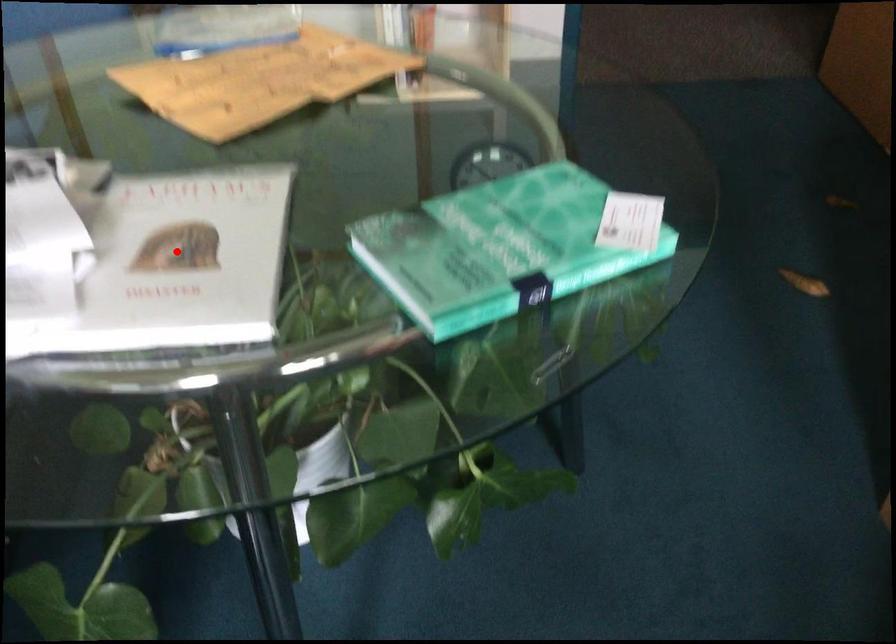
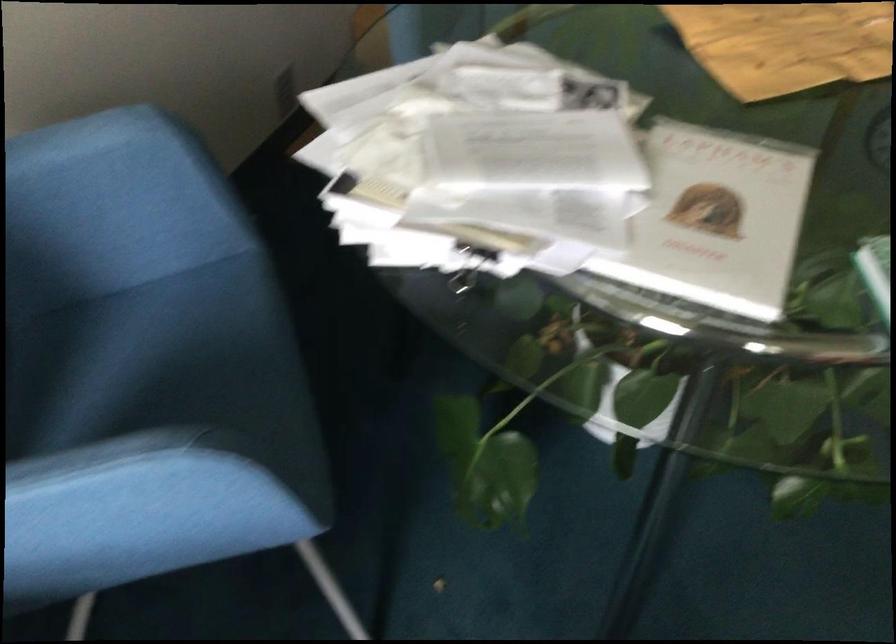
In the second image, find the point that corresponds to the highlighted location in the first image.

(716, 220)